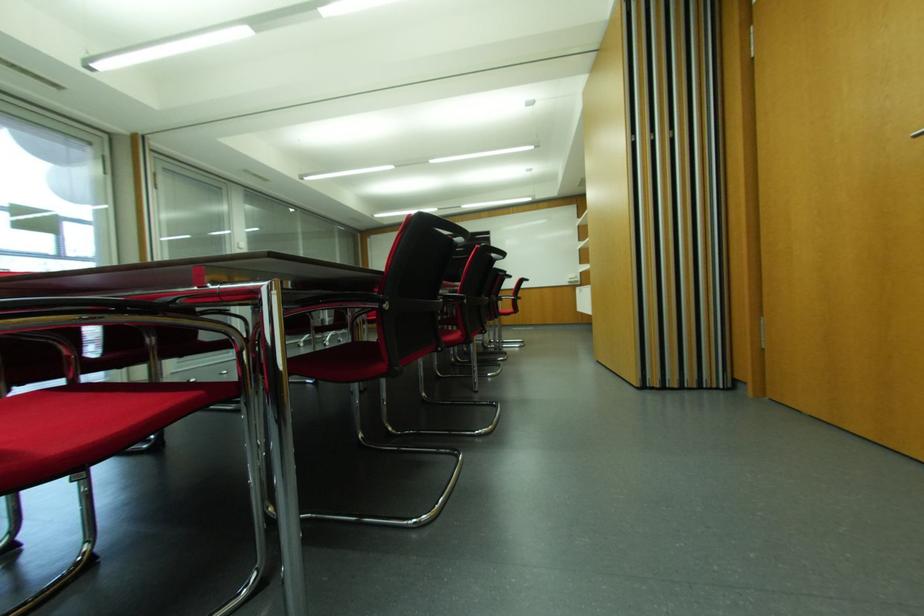
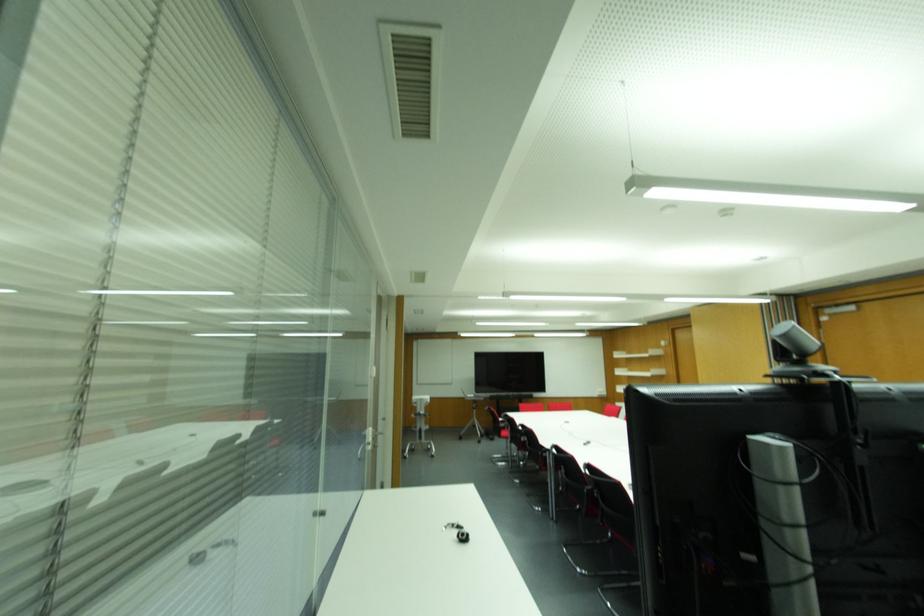
Question: What movement of the cameraman would produce the second image?

Choices:
 (A) Left
 (B) Right
 (C) Forward
 (D) Backward

Answer: (A)